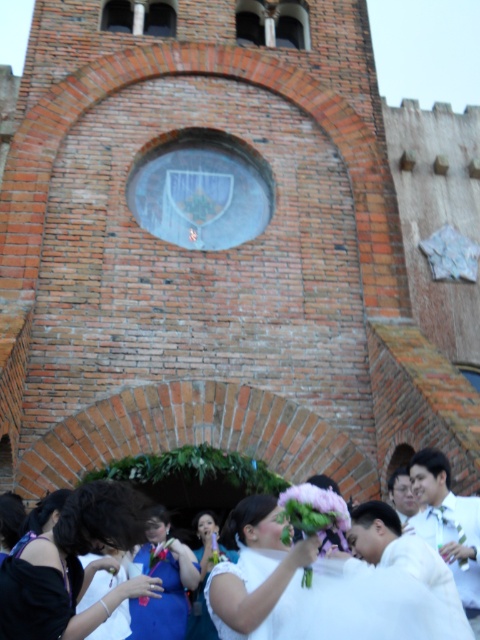
You are a photographer at the wedding and want to capture a photo of both the white satin dress at lower center and the white glossy shirt at lower right in the same frame. Which direction should you move to ensure both are visible?

To include both the white satin dress at lower center and the white glossy shirt at lower right in the frame, move to the left of the white glossy shirt at lower right so that the white satin dress at lower center comes into view to its left.

You are a photographer positioned at the origin point of the coordinate system. You want to take a photo of the white satin dress at center. What are the coordinates where you should aim your camera?

The coordinates to aim the camera are at point (360, 608) where the white satin dress at center is located.

You are a photographer at a wedding. The bride is wearing a white satin dress at lower center. You need to position a bouquet of pink flowers exactly at point (72, 566). Will the bouquet interfere with the white satin dress at lower center?

The point (72, 566) is where the white satin dress at lower center is located, so placing the bouquet there would interfere with the dress.